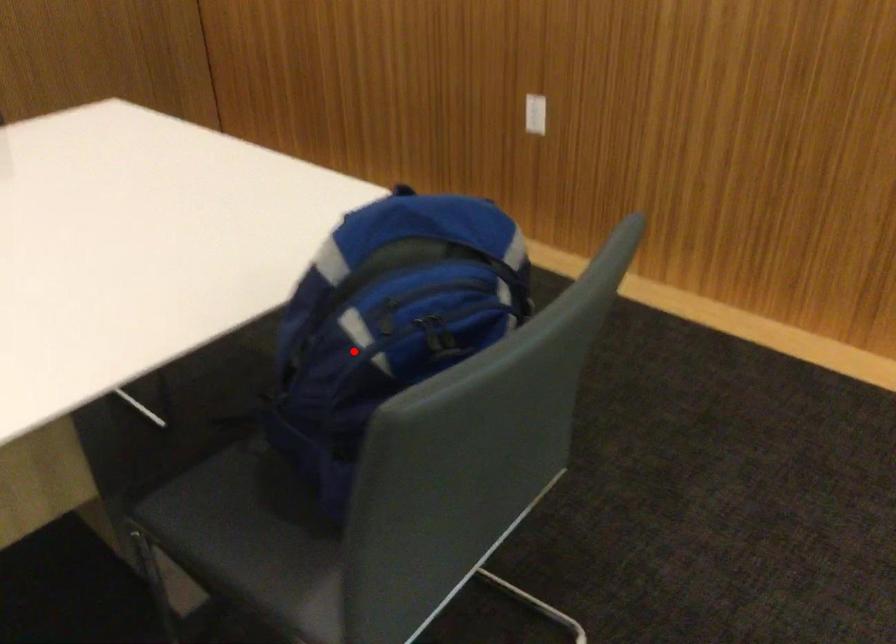
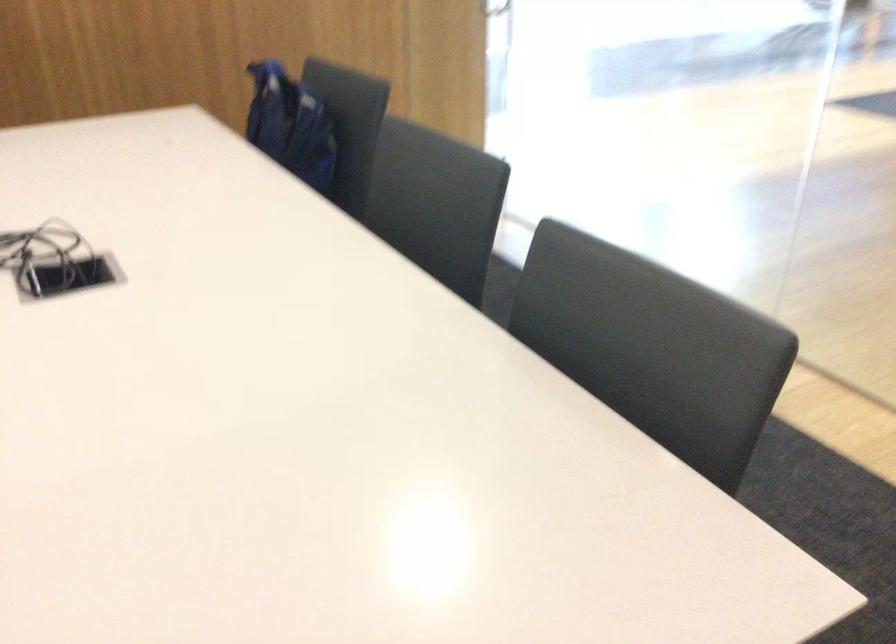
Find the pixel in the second image that matches the highlighted location in the first image.

(289, 125)